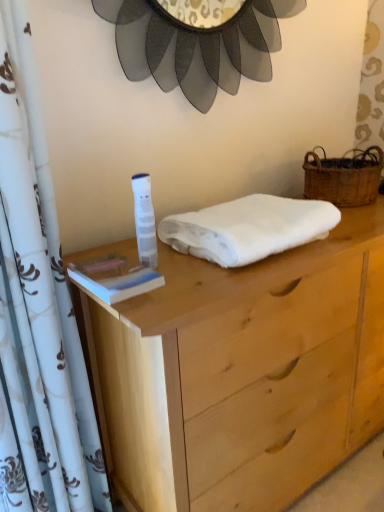
Identify the location of vacant area that lies in front of white plastic tube at center. (168, 294).